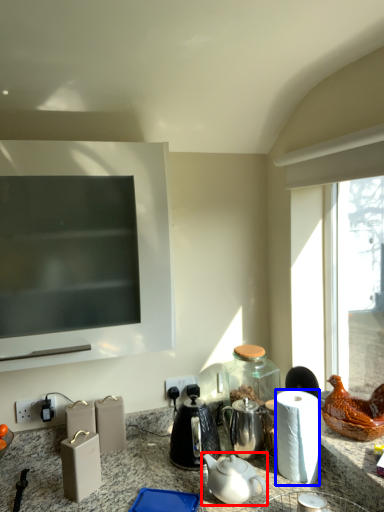
Question: Which point is further to the camera, teapot (highlighted by a red box) or paper towel (highlighted by a blue box)?

Choices:
 (A) teapot
 (B) paper towel

Answer: (B)